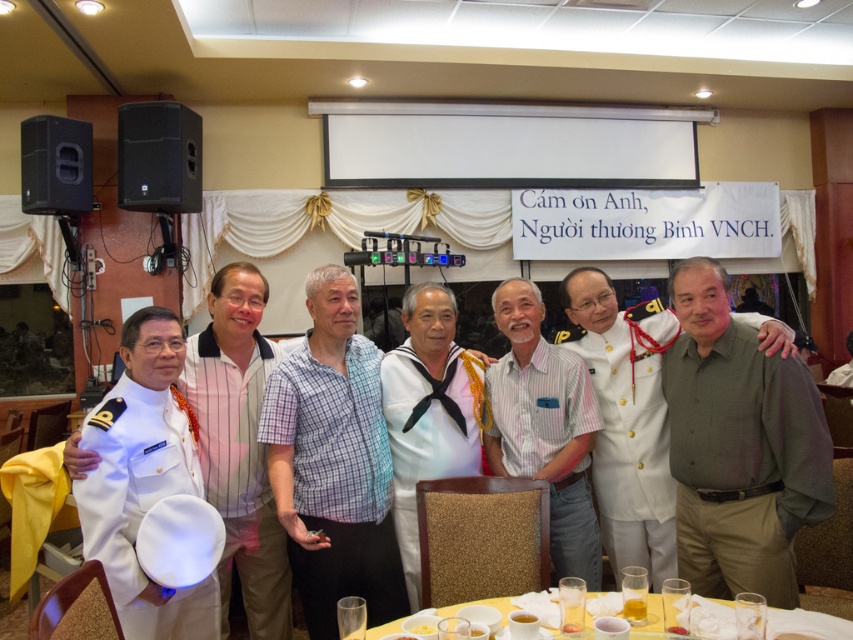
Which is below, white uniform at left or yellow plastic table at lower center?

yellow plastic table at lower center is lower down.

Who is positioned more to the right, white uniform at left or yellow plastic table at lower center?

yellow plastic table at lower center

Is point (70, 460) positioned after point (781, 618)?

That is True.

Identify the location of white uniform at left. (239, 445).

You are a GUI agent. You are given a task and a screenshot of the screen. Output one action in this format:
    pyautogui.click(x=<x>, y=<y>)
    Task: Click on the green cotton shirt at center
    The image size is (853, 640).
    Given the screenshot: What is the action you would take?
    pyautogui.click(x=625, y=419)

Who is taller, green cotton shirt at center or white striped shirt at center?

Standing taller between the two is green cotton shirt at center.

Describe the element at coordinates (625, 419) in the screenshot. I see `green cotton shirt at center` at that location.

Where is `green cotton shirt at center`? This screenshot has width=853, height=640. green cotton shirt at center is located at coordinates (625, 419).

Which is below, plaid shirt at center or green cotton shirt at center?

green cotton shirt at center is lower down.

Find the location of a particular element. Image resolution: width=853 pixels, height=640 pixels. plaid shirt at center is located at coordinates (334, 461).